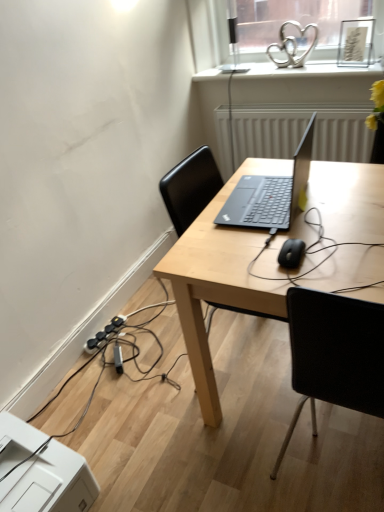
Question: Is the depth of light wood desk at center less than that of white textured radiator at center?

Choices:
 (A) yes
 (B) no

Answer: (A)

Question: Can you confirm if light wood desk at center is shorter than white textured radiator at center?

Choices:
 (A) no
 (B) yes

Answer: (A)

Question: Could you tell me if light wood desk at center is facing white textured radiator at center?

Choices:
 (A) no
 (B) yes

Answer: (A)

Question: Is light wood desk at center with white textured radiator at center?

Choices:
 (A) no
 (B) yes

Answer: (A)

Question: Are light wood desk at center and white textured radiator at center far apart?

Choices:
 (A) no
 (B) yes

Answer: (B)

Question: Is sleek silver laptop at center taller or shorter than black plastic extension cord at lower left?

Choices:
 (A) short
 (B) tall

Answer: (B)

Question: Which is correct: sleek silver laptop at center is inside black plastic extension cord at lower left, or outside of it?

Choices:
 (A) outside
 (B) inside

Answer: (A)

Question: From the image's perspective, is sleek silver laptop at center above or below black plastic extension cord at lower left?

Choices:
 (A) above
 (B) below

Answer: (A)

Question: Considering their positions, is sleek silver laptop at center located in front of or behind black plastic extension cord at lower left?

Choices:
 (A) behind
 (B) front

Answer: (B)

Question: Is black matte mouse at center bigger or smaller than black plastic extension cord at lower left?

Choices:
 (A) big
 (B) small

Answer: (B)

Question: Considering the positions of black matte mouse at center and black plastic extension cord at lower left in the image, is black matte mouse at center wider or thinner than black plastic extension cord at lower left?

Choices:
 (A) thin
 (B) wide

Answer: (B)

Question: From a real-world perspective, relative to black plastic extension cord at lower left, is black matte mouse at center vertically above or below?

Choices:
 (A) above
 (B) below

Answer: (A)

Question: Which is correct: black matte mouse at center is inside black plastic extension cord at lower left, or outside of it?

Choices:
 (A) inside
 (B) outside

Answer: (B)

Question: In the image, is white textured radiator at center positioned in front of or behind black matte mouse at center?

Choices:
 (A) front
 (B) behind

Answer: (B)

Question: Is white textured radiator at center taller or shorter than black matte mouse at center?

Choices:
 (A) short
 (B) tall

Answer: (B)